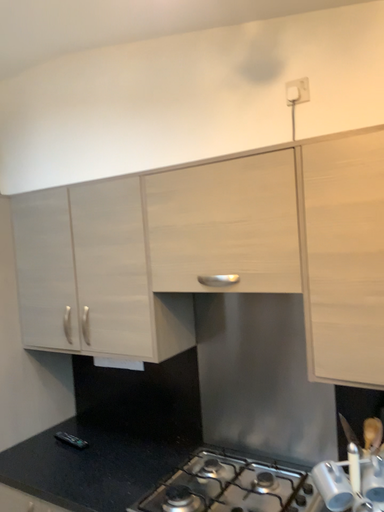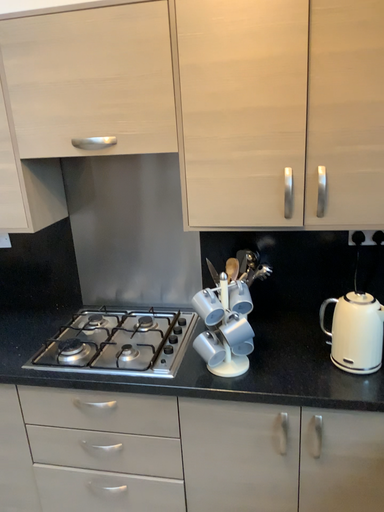
Question: Which way did the camera rotate in the video?

Choices:
 (A) rotated upward
 (B) rotated downward

Answer: (B)